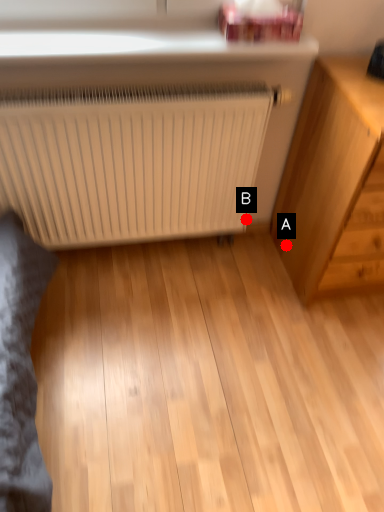
Question: Two points are circled on the image, labeled by A and B beside each circle. Which point is closer to the camera?

Choices:
 (A) A is closer
 (B) B is closer

Answer: (A)